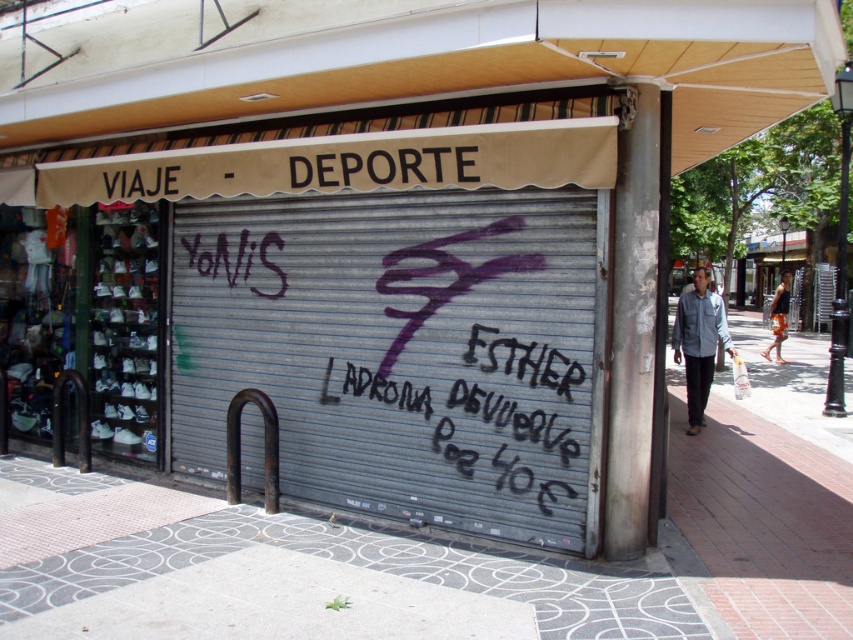
Question: Does metallic gray garage door at center have a larger size compared to gray concrete sidewalk at lower center?

Choices:
 (A) yes
 (B) no

Answer: (A)

Question: Which point appears closest to the camera in this image?

Choices:
 (A) (177, 234)
 (B) (221, 534)

Answer: (B)

Question: Which object is farther from the camera taking this photo?

Choices:
 (A) gray concrete sidewalk at lower center
 (B) black chalk writing at center

Answer: (B)

Question: Which of the following is the closest to the observer?

Choices:
 (A) black chalk writing at center
 (B) gray concrete sidewalk at lower center

Answer: (B)

Question: Considering the relative positions of gray concrete sidewalk at lower center and black chalk writing at center in the image provided, where is gray concrete sidewalk at lower center located with respect to black chalk writing at center?

Choices:
 (A) left
 (B) right

Answer: (A)

Question: Is gray concrete sidewalk at lower center closer to the viewer compared to black chalk writing at center?

Choices:
 (A) yes
 (B) no

Answer: (A)